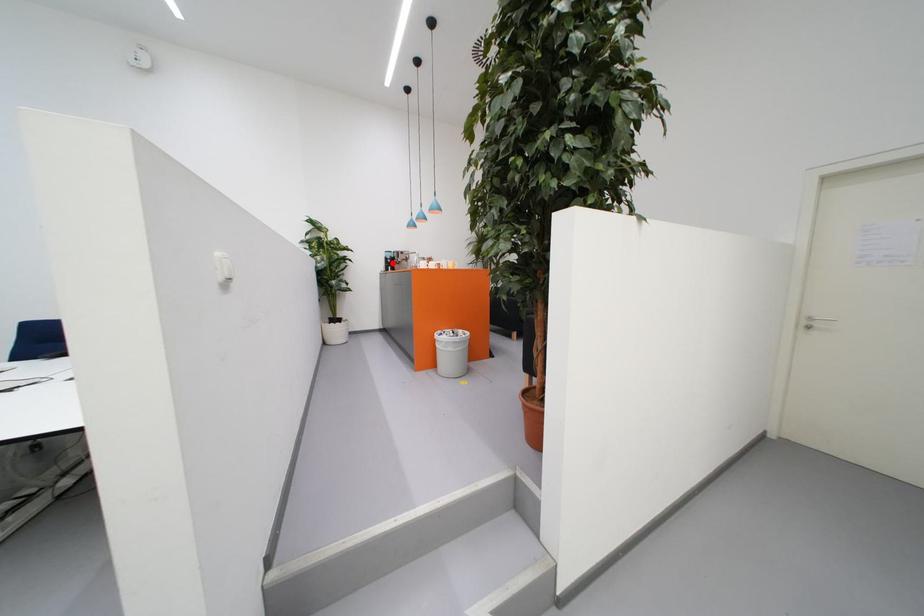
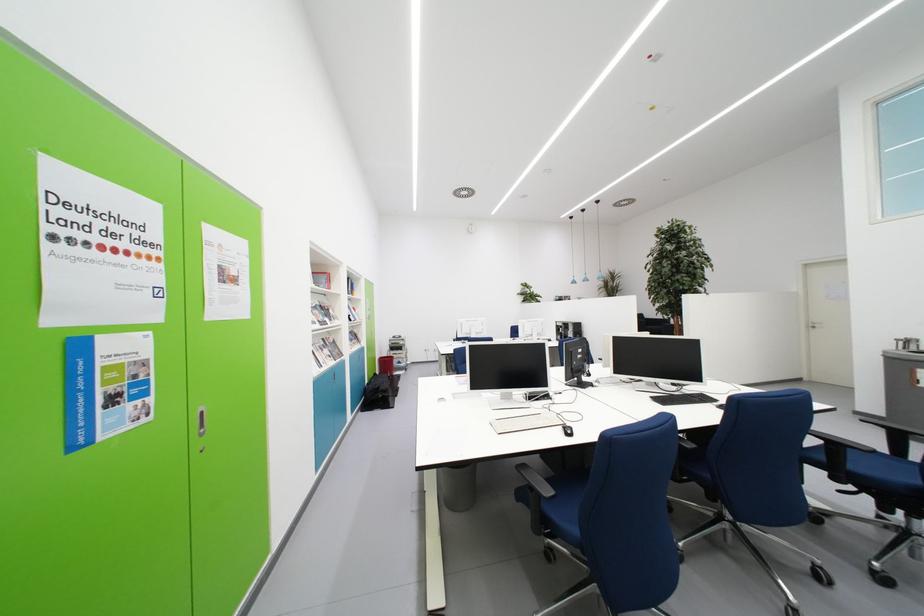
Question: I am providing you with two images of the same scene from different viewpoints. A red point is marked on the first image. Can you still see the location of the red point in image 2?

Choices:
 (A) Yes
 (B) No

Answer: (B)